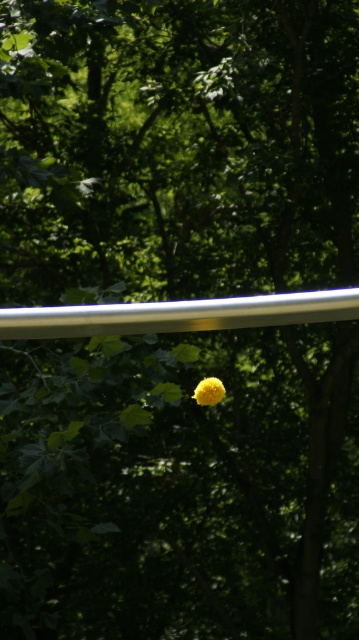
Is silver metallic rail at upper center smaller than yellow fuzzy ball at center?

No.

Measure the distance from silver metallic rail at upper center to yellow fuzzy ball at center.

A distance of 17.18 inches exists between silver metallic rail at upper center and yellow fuzzy ball at center.

What do you see at coordinates (179, 314) in the screenshot? I see `silver metallic rail at upper center` at bounding box center [179, 314].

This screenshot has width=359, height=640. I want to click on silver metallic rail at upper center, so click(179, 314).